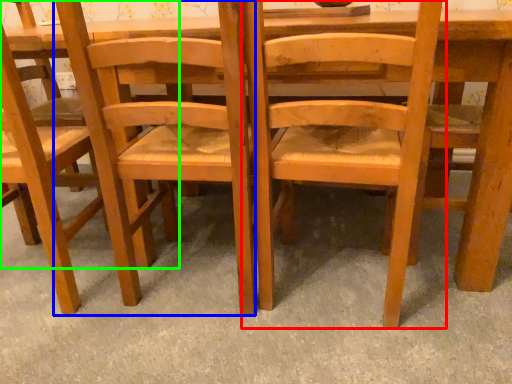
Question: Considering the real-world distances, which object is closest to chair (highlighted by a red box)? chair (highlighted by a blue box) or chair (highlighted by a green box).

Choices:
 (A) chair
 (B) chair

Answer: (A)